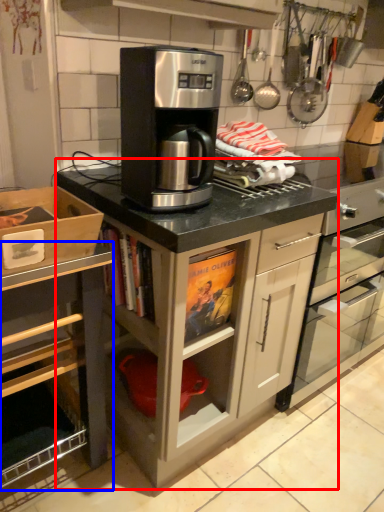
Question: Which point is closer to the camera, cabinetry (highlighted by a red box) or cabinetry (highlighted by a blue box)?

Choices:
 (A) cabinetry
 (B) cabinetry

Answer: (B)